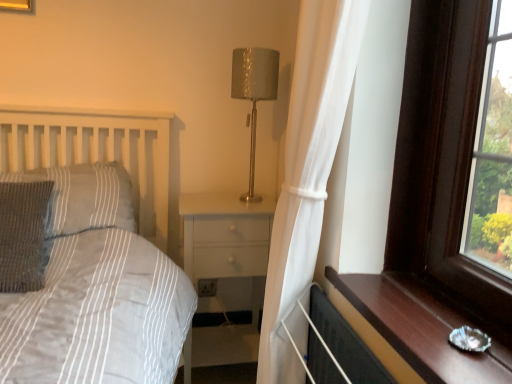
Question: From a real-world perspective, is knitted gray pillow at left, the 2th pillow positioned from the back, located beneath metallic gold table lamp at center?

Choices:
 (A) no
 (B) yes

Answer: (B)

Question: Can you confirm if knitted gray pillow at left, the 2th pillow positioned from the back, is taller than metallic gold table lamp at center?

Choices:
 (A) no
 (B) yes

Answer: (A)

Question: Is knitted gray pillow at left, acting as the 1th pillow starting from the front, with metallic gold table lamp at center?

Choices:
 (A) yes
 (B) no

Answer: (B)

Question: Could you tell me if knitted gray pillow at left, the 2th pillow positioned from the back, is facing metallic gold table lamp at center?

Choices:
 (A) yes
 (B) no

Answer: (B)

Question: Is knitted gray pillow at left, the 2th pillow positioned from the back, oriented away from metallic gold table lamp at center?

Choices:
 (A) no
 (B) yes

Answer: (A)

Question: From a real-world perspective, is brown wooden window sill at right above or below white glossy nightstand at center?

Choices:
 (A) above
 (B) below

Answer: (A)

Question: Is brown wooden window sill at right inside or outside of white glossy nightstand at center?

Choices:
 (A) inside
 (B) outside

Answer: (B)

Question: Is brown wooden window sill at right bigger or smaller than white glossy nightstand at center?

Choices:
 (A) big
 (B) small

Answer: (B)

Question: Considering the positions of point (503, 372) and point (263, 228), is point (503, 372) closer or farther from the camera than point (263, 228)?

Choices:
 (A) farther
 (B) closer

Answer: (B)

Question: From a real-world perspective, relative to knitted fabric pillow at left, positioned as the second pillow in front-to-back order, is knitted gray pillow at left, the 2th pillow positioned from the back, vertically above or below?

Choices:
 (A) above
 (B) below

Answer: (B)

Question: Based on their sizes in the image, would you say knitted gray pillow at left, the 2th pillow positioned from the back, is bigger or smaller than knitted fabric pillow at left, positioned as the second pillow in front-to-back order?

Choices:
 (A) big
 (B) small

Answer: (B)

Question: In terms of width, does knitted gray pillow at left, acting as the 1th pillow starting from the front, look wider or thinner when compared to knitted fabric pillow at left, positioned as the second pillow in front-to-back order?

Choices:
 (A) thin
 (B) wide

Answer: (A)

Question: Is knitted gray pillow at left, acting as the 1th pillow starting from the front, inside or outside of knitted fabric pillow at left, the 1th pillow when ordered from back to front?

Choices:
 (A) inside
 (B) outside

Answer: (B)

Question: From the image's perspective, is black rubber radiator at lower right located above or below knitted fabric pillow at left, the 1th pillow when ordered from back to front?

Choices:
 (A) above
 (B) below

Answer: (B)

Question: Would you say black rubber radiator at lower right is to the left or to the right of knitted fabric pillow at left, the 1th pillow when ordered from back to front, in the picture?

Choices:
 (A) left
 (B) right

Answer: (B)